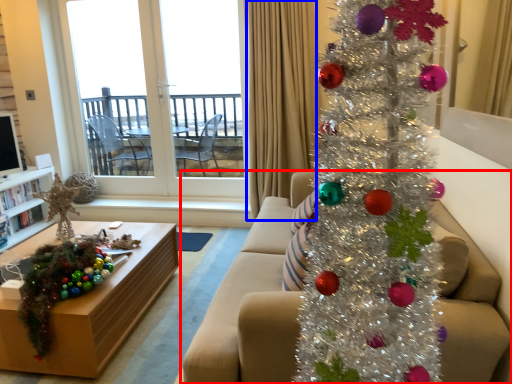
Question: Among these objects, which one is nearest to the camera, studio couch (highlighted by a red box) or curtain (highlighted by a blue box)?

Choices:
 (A) studio couch
 (B) curtain

Answer: (A)